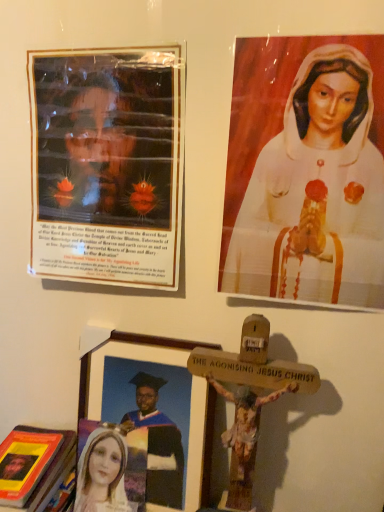
Question: Is matte plastic poster at upper left, the first picture frame from the top, in front of or behind white glossy statue at upper right in the image?

Choices:
 (A) front
 (B) behind

Answer: (B)

Question: Is point (168, 168) closer or farther from the camera than point (380, 248)?

Choices:
 (A) closer
 (B) farther

Answer: (B)

Question: Which object is positioned closest to the wooden picture frame at lower center, the second picture frame viewed from the top?

Choices:
 (A) white glossy statue at upper right
 (B) hardcover book at lower left
 (C) matte plastic poster at upper left, the first picture frame from the top

Answer: (B)

Question: Considering the real-world distances, which object is farthest from the hardcover book at lower left?

Choices:
 (A) matte plastic poster at upper left, the first picture frame from the top
 (B) white glossy statue at upper right
 (C) wooden picture frame at lower center, which is the first picture frame in bottom-to-top order

Answer: (B)